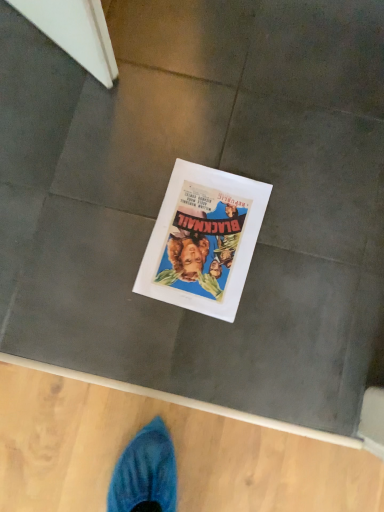
In order to click on empty space that is ontop of matte paper poster at center in this screenshot , I will do `click(204, 234)`.